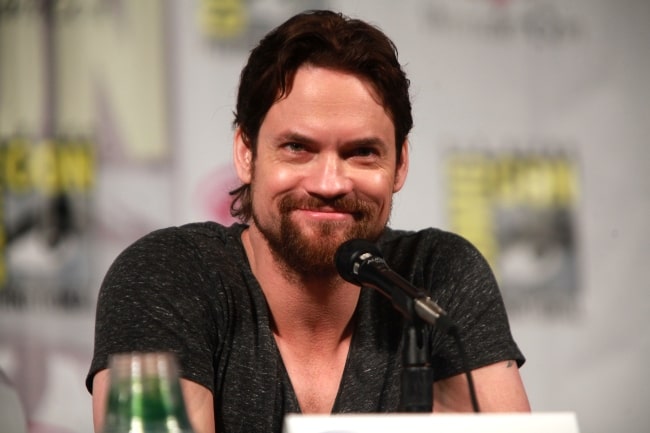
The height and width of the screenshot is (433, 650). Identify the location of step-and-repeat backdrop. (452, 117).